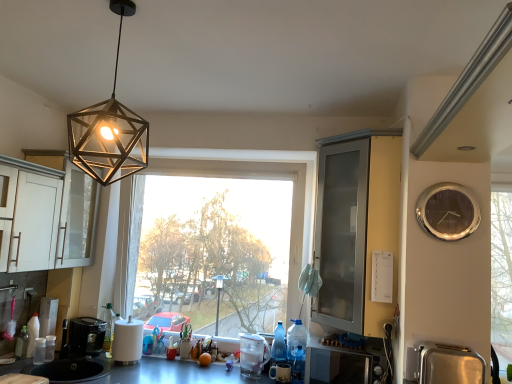
The image size is (512, 384). What are the coordinates of `free spot to the left of clear plastic blender at center, which is the second appliance in left-to-right order` in the screenshot? It's located at (220, 377).